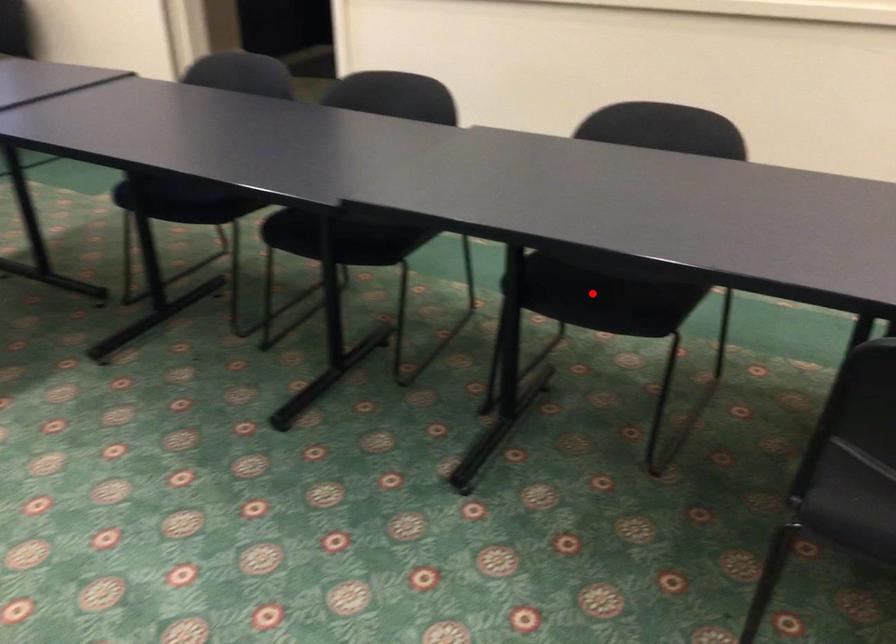
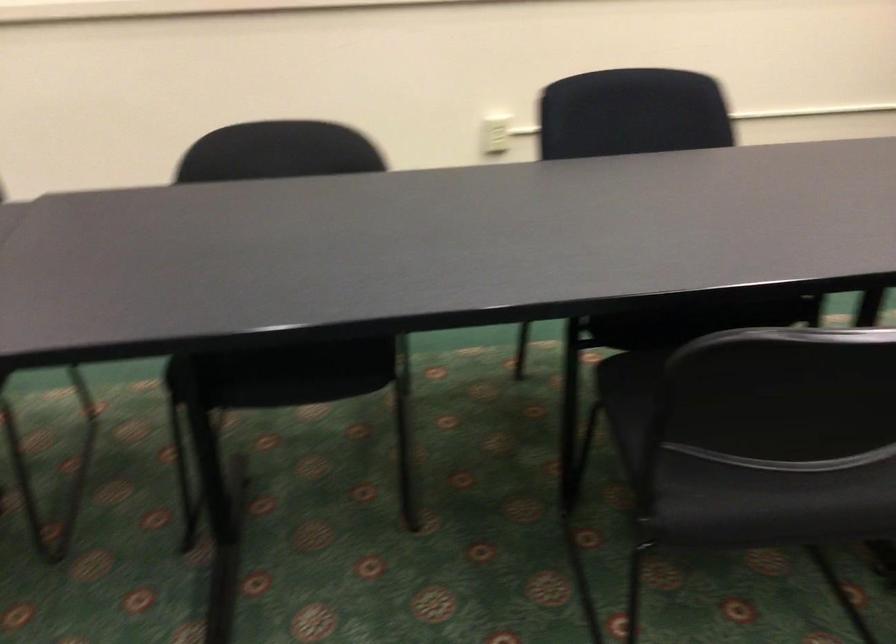
Question: I am providing you with two images of the same scene from different viewpoints. Given a red point in image1, look at the same physical point in image2. Is it:

Choices:
 (A) Closer to the viewpoint
 (B) Farther from the viewpoint

Answer: (A)